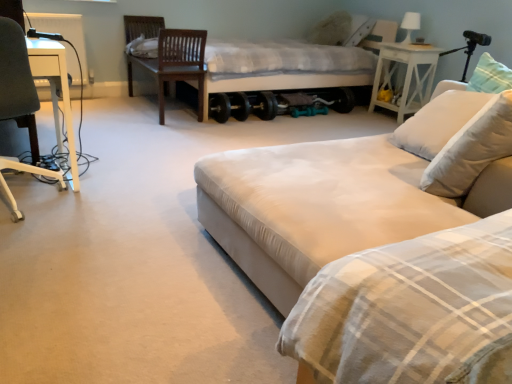
Identify the location of free location to the right of white plastic chair at left. This screenshot has height=384, width=512. click(115, 202).